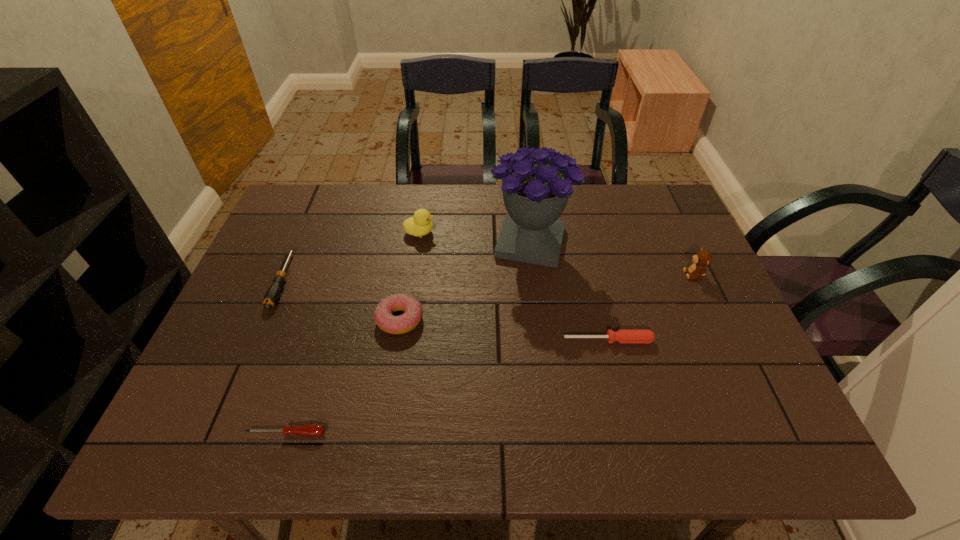
At what (x,y) coordinates should I click in order to perform the action: click on free space at the near right corner of the desktop. Please return your answer as a coordinate pair (x, y). This screenshot has height=540, width=960. Looking at the image, I should click on (776, 428).

The height and width of the screenshot is (540, 960). I want to click on blank region between the duckling and the bouquet, so click(x=475, y=238).

At what (x,y) coordinates should I click in order to perform the action: click on free space between the doughnut and the sixth tallest object. Please return your answer as a coordinate pair (x, y). Image resolution: width=960 pixels, height=540 pixels. Looking at the image, I should click on (504, 330).

What are the coordinates of `empty space that is in between the nearest screwdriver and the bouquet` in the screenshot? It's located at (408, 338).

Where is `vacant area that lies between the rightmost screwdriver and the duckling`? vacant area that lies between the rightmost screwdriver and the duckling is located at coordinates (514, 286).

The height and width of the screenshot is (540, 960). In order to click on free spot between the doughnut and the rightmost object in this screenshot , I will do `click(547, 297)`.

Identify the location of vacant space in between the shortest screwdriver and the duckling. Image resolution: width=960 pixels, height=540 pixels. (353, 333).

The width and height of the screenshot is (960, 540). Identify the location of free space between the duckling and the tallest screwdriver. (351, 256).

Where is `empty space that is in between the teddy bear and the leftmost object`? The height and width of the screenshot is (540, 960). empty space that is in between the teddy bear and the leftmost object is located at coordinates (489, 277).

What are the coordinates of `vacant space that is in between the rightmost screwdriver and the duckling` in the screenshot? It's located at (514, 286).